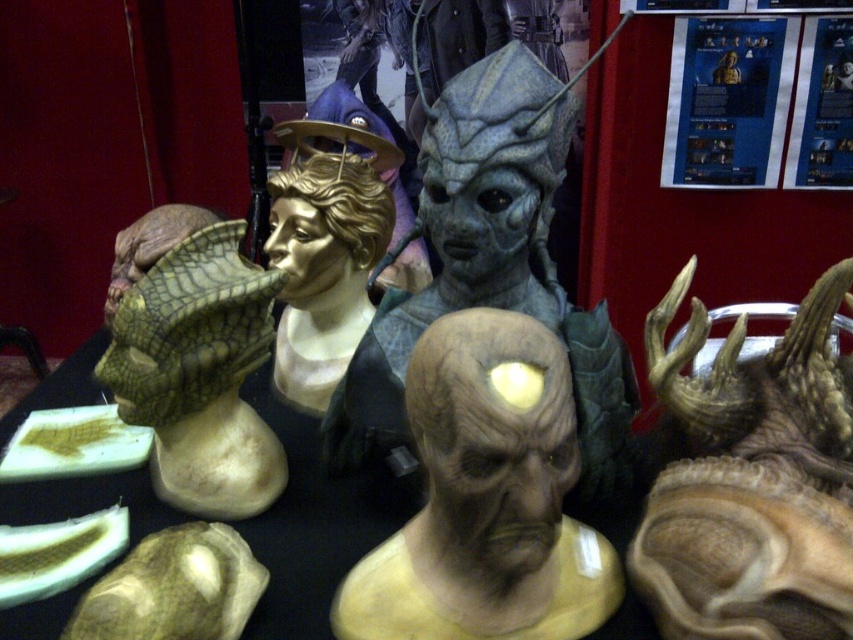
Question: Among these points, which one is farthest from the camera?

Choices:
 (A) (733, 609)
 (B) (486, 545)
 (C) (146, 221)

Answer: (C)

Question: Considering the real-world distances, which object is closest to the matte gray mask at center?

Choices:
 (A) green scaly mask at left
 (B) shiny metallic horns at upper right

Answer: (B)

Question: Does shiny metallic horns at upper right appear under green scaly mask at left?

Choices:
 (A) yes
 (B) no

Answer: (A)

Question: Can you confirm if shiny metallic horns at upper right is bigger than green scaly mask at left?

Choices:
 (A) no
 (B) yes

Answer: (B)

Question: Can you confirm if shiny metallic horns at upper right is positioned to the right of matte gray mask at center?

Choices:
 (A) no
 (B) yes

Answer: (B)

Question: Which object appears farthest from the camera in this image?

Choices:
 (A) matte gray mask at center
 (B) green scaly mask at left

Answer: (B)